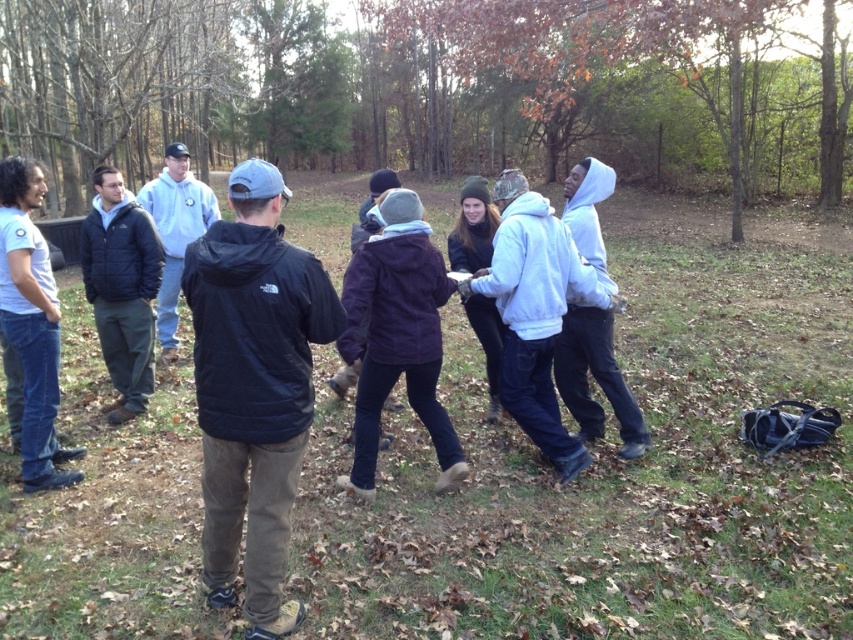
You are a photographer trying to capture a candid shot of the group. You notice the white fleece hoodie at center and the dark blue jacket at left. Which one is positioned lower in the frame?

The white fleece hoodie at center is positioned lower in the frame than the dark blue jacket at left.